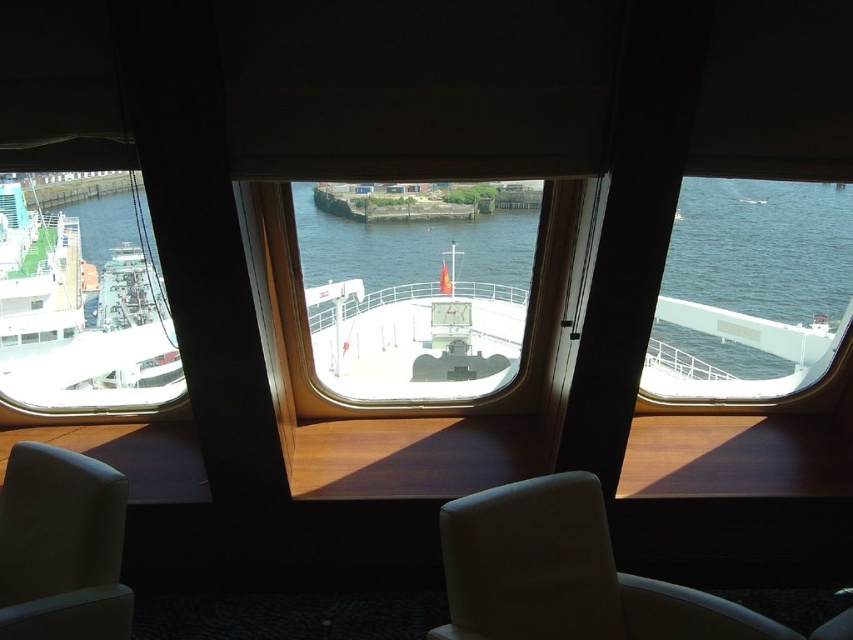
Question: Observing the image, what is the correct spatial positioning of white leather armchair at center in reference to matte gray armchair at lower left?

Choices:
 (A) right
 (B) left

Answer: (A)

Question: Which of the following is the farthest from the observer?

Choices:
 (A) (398, 378)
 (B) (80, 257)

Answer: (B)

Question: Does white glossy boat at center appear on the left side of matte gray armchair at lower left?

Choices:
 (A) no
 (B) yes

Answer: (A)

Question: Which point appears closest to the camera in this image?

Choices:
 (A) pyautogui.click(x=753, y=186)
 (B) pyautogui.click(x=543, y=516)

Answer: (B)

Question: Which object is positioned closest to the dark blue water at right?

Choices:
 (A) matte gray armchair at lower left
 (B) white glossy boat at left

Answer: (A)

Question: Considering the relative positions of white leather armchair at center and matte gray armchair at lower left in the image provided, where is white leather armchair at center located with respect to matte gray armchair at lower left?

Choices:
 (A) left
 (B) right

Answer: (B)